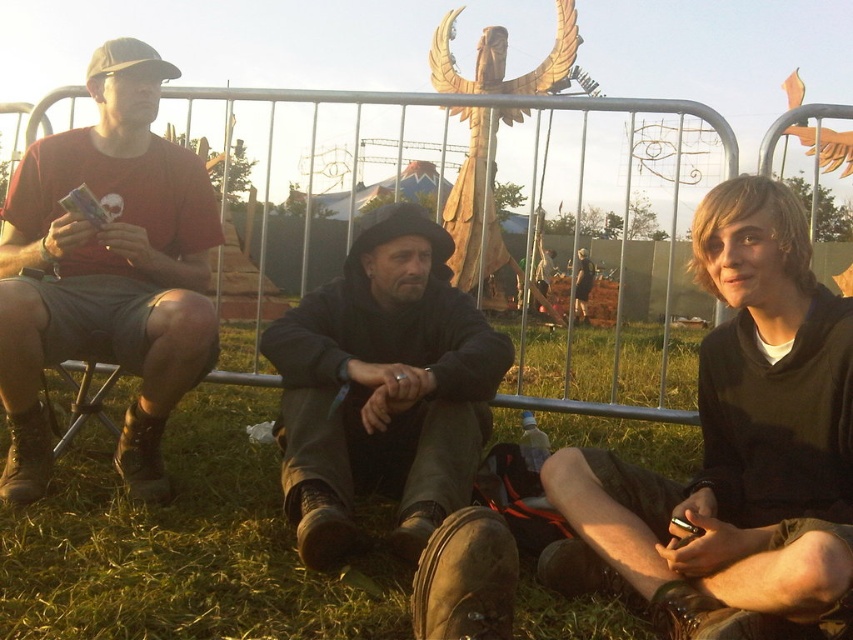
Is point (51, 164) farther from viewer compared to point (460, 97)?

No, it is not.

From the picture: Between matte black shirt at left and metallic silver fence at center, which one is positioned higher?

metallic silver fence at center is above.

This screenshot has width=853, height=640. Describe the element at coordinates (106, 272) in the screenshot. I see `matte black shirt at left` at that location.

This screenshot has height=640, width=853. I want to click on matte black shirt at left, so coord(106,272).

Can you confirm if black matte hoodie at center is positioned to the right of matte black shirt at left?

Correct, you'll find black matte hoodie at center to the right of matte black shirt at left.

Where is `black matte hoodie at center`? The height and width of the screenshot is (640, 853). black matte hoodie at center is located at coordinates (740, 448).

This screenshot has width=853, height=640. I want to click on black matte hoodie at center, so click(x=740, y=448).

At what (x,y) coordinates should I click in order to perform the action: click on black matte hoodie at center. Please return your answer as a coordinate pair (x, y). The image size is (853, 640). Looking at the image, I should click on (740, 448).

Is dark gray fabric jacket at center in front of metallic silver fence at center?

That is True.

Which of these two, dark gray fabric jacket at center or metallic silver fence at center, stands taller?

With more height is metallic silver fence at center.

Who is more forward, [343,550] or [419,106]?

Positioned in front is point [343,550].

The width and height of the screenshot is (853, 640). I want to click on dark gray fabric jacket at center, so pos(383,387).